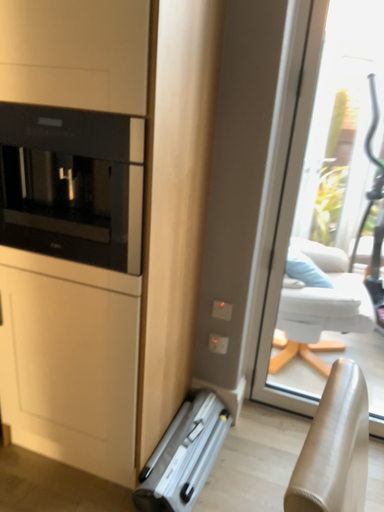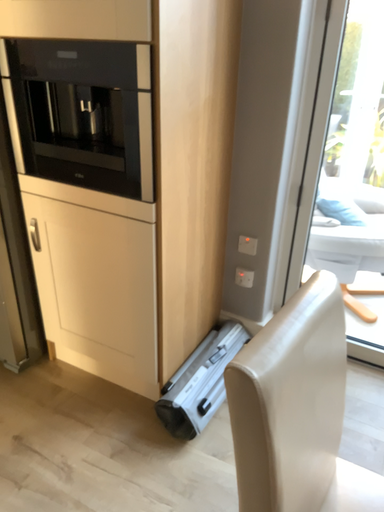
Question: How did the camera likely rotate when shooting the video?

Choices:
 (A) rotated right
 (B) rotated left

Answer: (B)